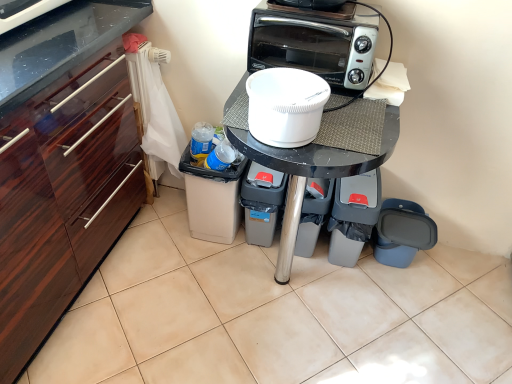
You are a GUI agent. You are given a task and a screenshot of the screen. Output one action in this format:
    pyautogui.click(x=<x>, y=<y>)
    Task: Click on the vacant area that lies between black glossy table at center and blue plastic trash can at lower right, which appears as the fourth appliance when viewed from the left
    
    Given the screenshot: What is the action you would take?
    pyautogui.click(x=371, y=304)